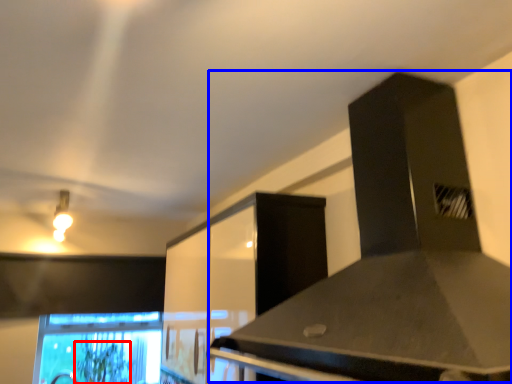
Question: Which object appears farthest to the camera in this image, plant (highlighted by a red box) or vent (highlighted by a blue box)?

Choices:
 (A) plant
 (B) vent

Answer: (A)